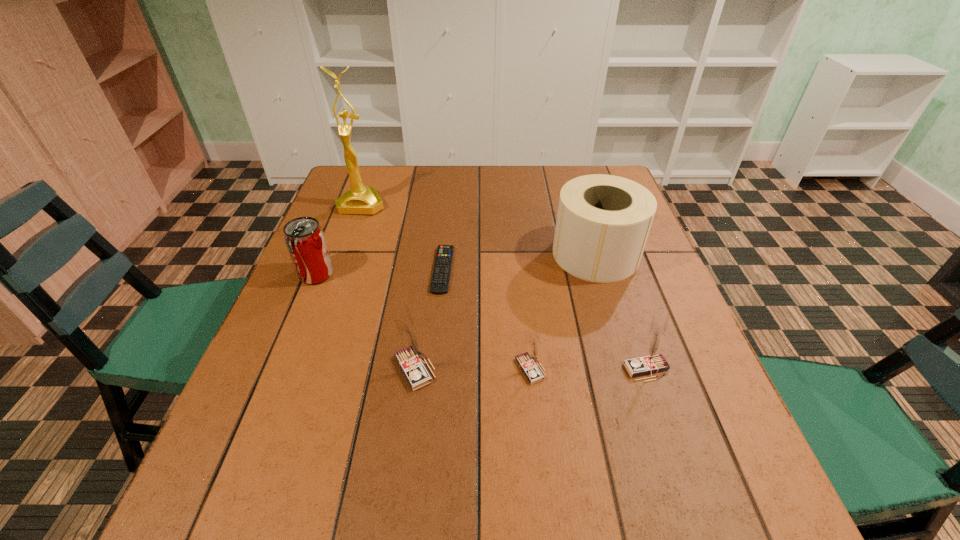
The width and height of the screenshot is (960, 540). What are the coordinates of `vacant place for an extra matchbox on the left` in the screenshot? It's located at point(299,369).